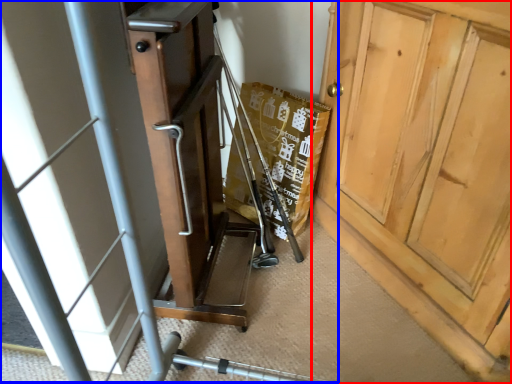
Question: Which of the following is the farthest to the observer, door (highlighted by a red box) or baby carriage (highlighted by a blue box)?

Choices:
 (A) door
 (B) baby carriage

Answer: (A)